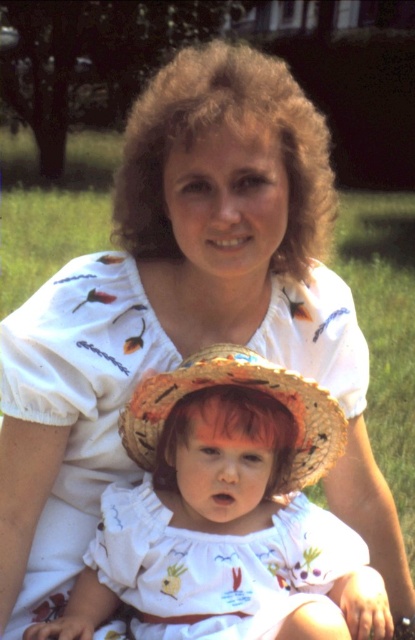
Question: Which of the following is the closest to the observer?

Choices:
 (A) (317, 529)
 (B) (332, 419)

Answer: (B)

Question: Is white cotton dress at center to the right of natural straw hat at center from the viewer's perspective?

Choices:
 (A) no
 (B) yes

Answer: (B)

Question: Can you confirm if white cotton dress at center is positioned to the left of natural straw hat at center?

Choices:
 (A) yes
 (B) no

Answer: (B)

Question: Is white cotton dress at center wider than natural straw hat at center?

Choices:
 (A) yes
 (B) no

Answer: (A)

Question: Among these objects, which one is farthest from the camera?

Choices:
 (A) white cotton dress at center
 (B) natural straw hat at center

Answer: (B)